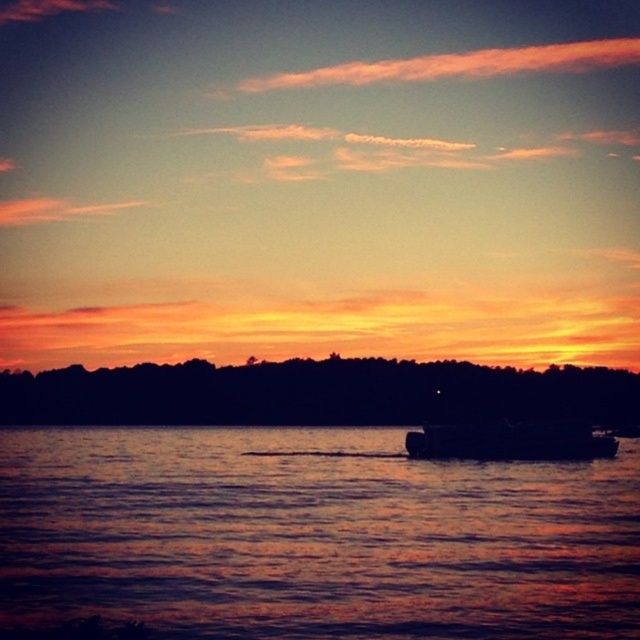
You are an artist trying to paint the sunset scene. You have to decide which area to focus on first between the shiny reflective water at center and the dark gray metallic boat at center. Which object should you paint first if you want to capture the largest area in the scene?

The shiny reflective water at center is bigger than the dark gray metallic boat at center, so you should paint the shiny reflective water at center first to capture the largest area in the scene.

You are an artist trying to paint this sunset scene. You want to ensure the silhouetted trees at lower center and the dark gray metallic boat at center are proportionally accurate. Which object should you draw wider in your painting?

The silhouetted trees at lower center should be drawn wider because their width is larger than the dark gray metallic boat at center according to the description.

You are standing on the shore of the lake and want to take a photo of the shiny reflective water at center. Based on its coordinates, where should you aim your camera?

The shiny reflective water at center is located at coordinates point (312, 536), so you should aim your camera towards that point to capture it.